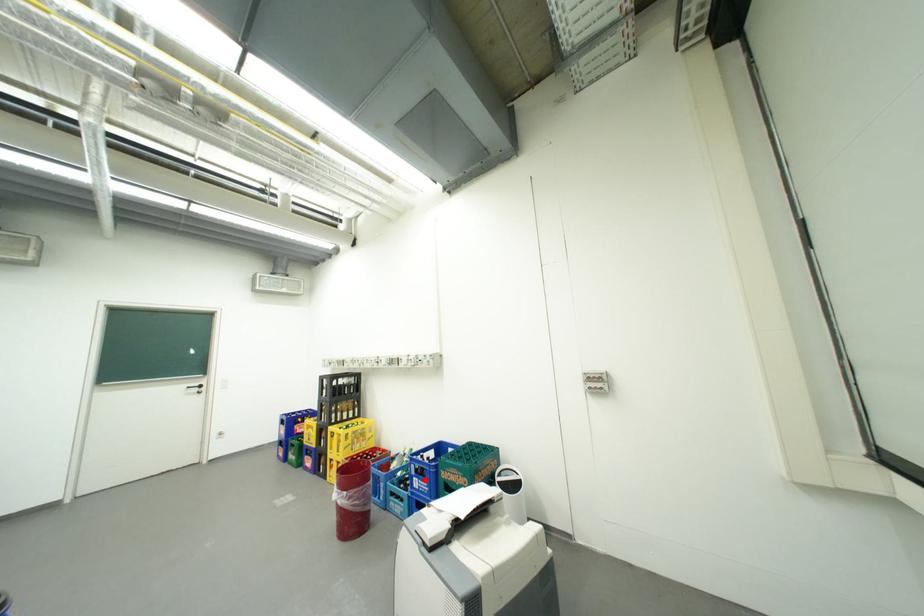
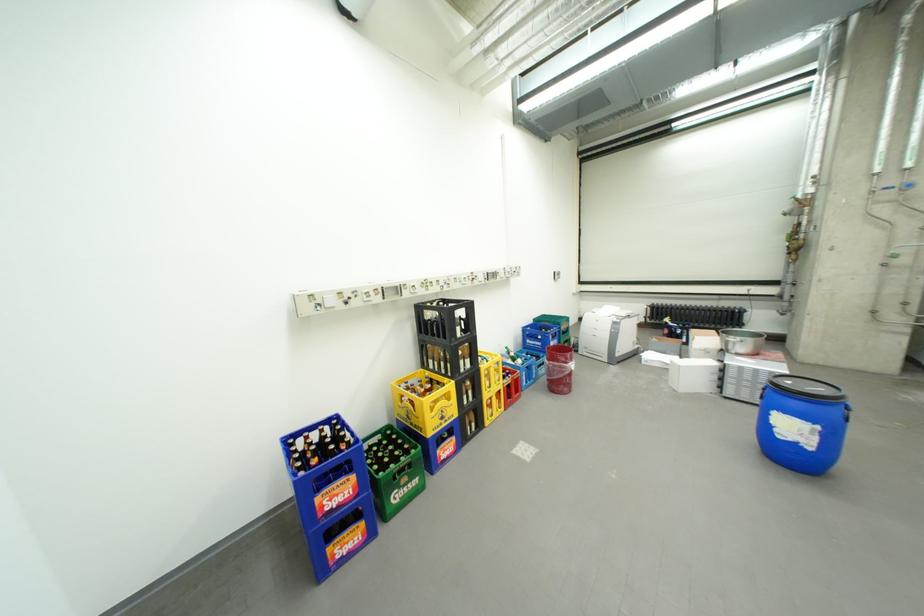
In the second image, find the point that corresponds to the highlighted location in the first image.

(562, 344)